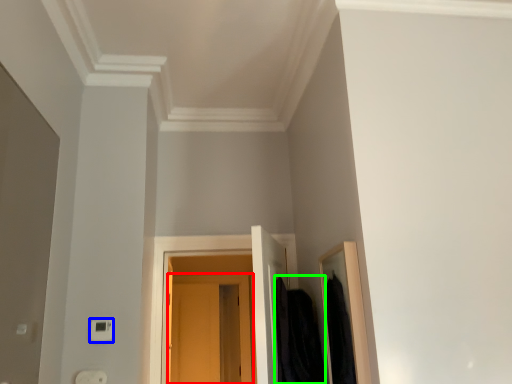
Question: Estimate the real-world distances between objects in this image. Which object is closer to door (highlighted by a red box), light switch (highlighted by a blue box) or clothing (highlighted by a green box)?

Choices:
 (A) light switch
 (B) clothing

Answer: (B)